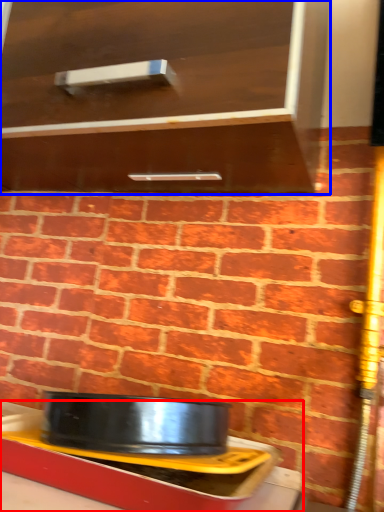
Question: Which object is further to the camera taking this photo, table (highlighted by a red box) or cabinetry (highlighted by a blue box)?

Choices:
 (A) table
 (B) cabinetry

Answer: (A)